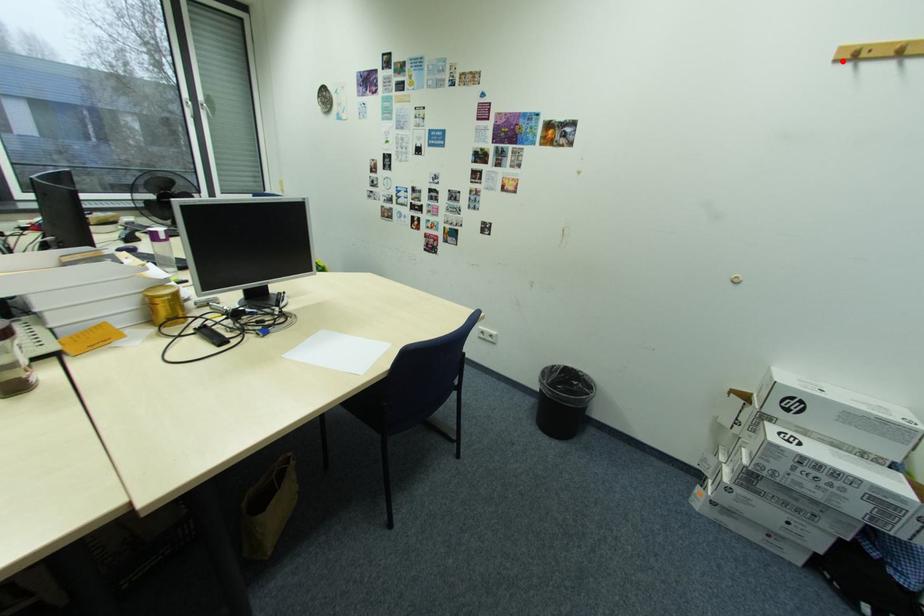
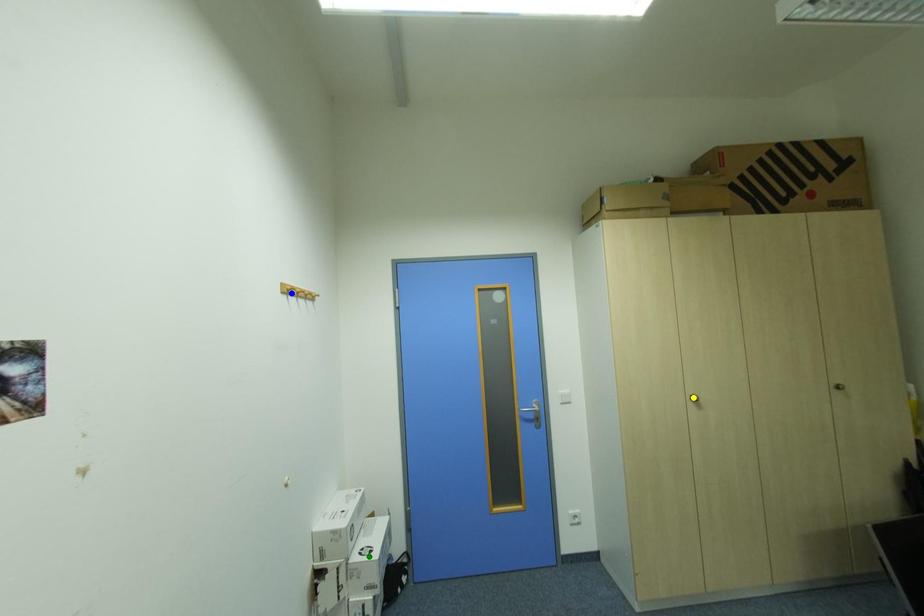
Question: I am providing you with two images of the same scene from different viewpoints. A red point is marked on the first image. You are given multiple points on the second image. Which mark in image 2 goes with the point in image 1?

Choices:
 (A) yellow point
 (B) blue point
 (C) green point

Answer: (B)